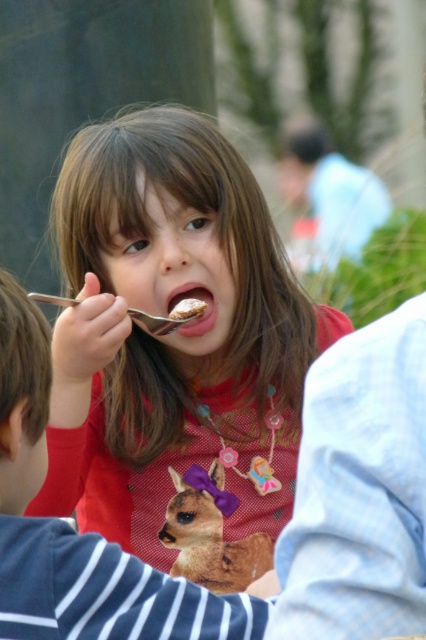
From the picture: Does matte red shirt at center have a larger size compared to white crumbly cake at mouth?

Yes.

Does matte red shirt at center have a smaller size compared to white crumbly cake at mouth?

No.

Who is more forward, [296,460] or [178,321]?

Point [178,321]

The image size is (426, 640). Find the location of `matte red shirt at center`. matte red shirt at center is located at coordinates tap(172, 333).

Does striped cotton shirt at lower left have a lesser width compared to silver metallic fork at mouth?

No.

Between point (5, 342) and point (160, 324), which one is positioned in front?

Positioned in front is point (5, 342).

Between point (28, 545) and point (175, 317), which one is positioned behind?

The point (175, 317) is more distant.

This screenshot has width=426, height=640. I want to click on striped cotton shirt at lower left, so click(77, 532).

Is matte red shirt at center smaller than striped cotton shirt at lower left?

No, matte red shirt at center is not smaller than striped cotton shirt at lower left.

The width and height of the screenshot is (426, 640). I want to click on matte red shirt at center, so click(x=172, y=333).